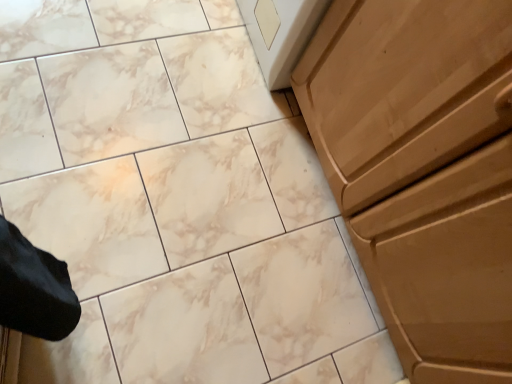
What do you see at coordinates (423, 170) in the screenshot?
I see `wooden chest of drawers at right` at bounding box center [423, 170].

Locate an element on the screen. wooden chest of drawers at right is located at coordinates (423, 170).

Locate an element on the screen. Image resolution: width=512 pixels, height=384 pixels. wooden chest of drawers at right is located at coordinates (423, 170).